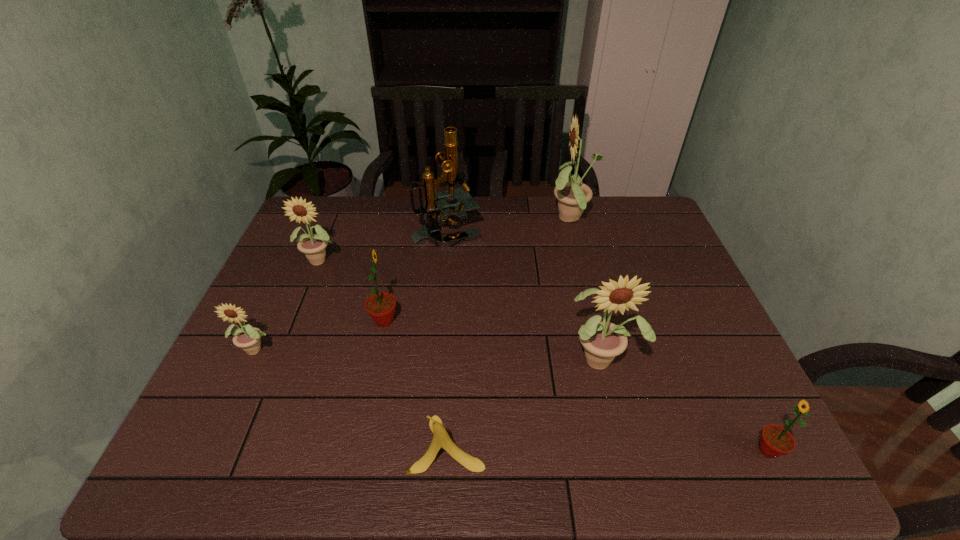
I want to click on free space between the third biggest yellow sunflower and the sixth shortest object, so click(x=462, y=309).

I want to click on vacant space that's between the smallest yellow sunflower and the smaller green sunflower, so click(x=513, y=399).

Locate an element on the screen. The height and width of the screenshot is (540, 960). vacant region between the smallest yellow sunflower and the sixth shortest object is located at coordinates (429, 353).

Where is `vacant space that is in between the banana and the sixth nearest object`? This screenshot has height=540, width=960. vacant space that is in between the banana and the sixth nearest object is located at coordinates (384, 352).

You are a GUI agent. You are given a task and a screenshot of the screen. Output one action in this format:
    pyautogui.click(x=<x>, y=<y>)
    Task: Click on the blank region between the second smallest yellow sunflower and the smallest yellow sunflower
    Image resolution: width=960 pixels, height=540 pixels.
    Given the screenshot: What is the action you would take?
    pyautogui.click(x=290, y=304)

I want to click on free point between the rightmost object and the third smallest yellow sunflower, so click(x=684, y=404).

I want to click on free space between the tallest sunflower and the fifth shortest sunflower, so click(x=587, y=289).

Locate an element on the screen. The image size is (960, 540). free space between the third smallest yellow sunflower and the smallest yellow sunflower is located at coordinates (429, 353).

Identify which object is the third closest to the nearest sunflower. Please provide its 2D coordinates. Your answer should be formatted as a tuple, i.e. [(x, y)], where the tuple contains the x and y coordinates of a point satisfying the conditions above.

[(573, 196)]

The height and width of the screenshot is (540, 960). I want to click on object that is the fourth closest to the shortest object, so click(x=312, y=245).